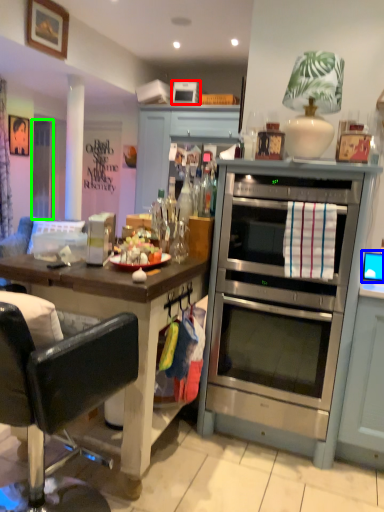
Question: Estimate the real-world distances between objects in this image. Which object is farther from appliance (highlighted by a red box), computer monitor (highlighted by a blue box) or glass door (highlighted by a green box)?

Choices:
 (A) computer monitor
 (B) glass door

Answer: (A)